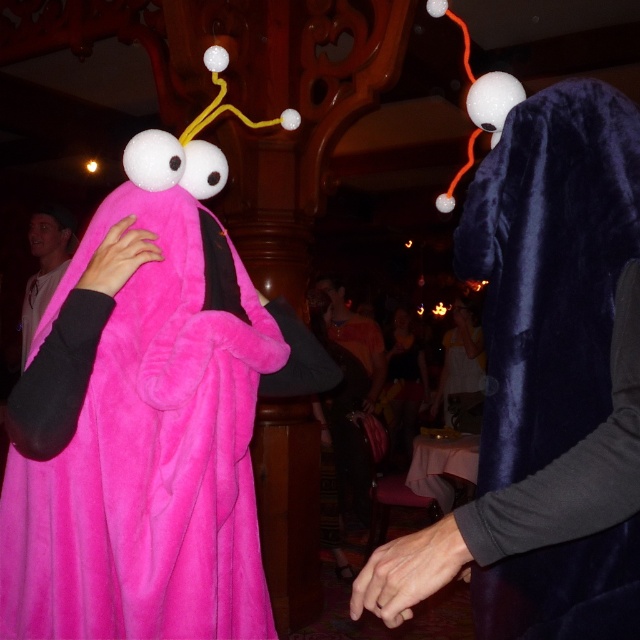
You are standing at the entrance of the event venue and want to greet both the pink fuzzy costume at left and the velvet blue mask at center. Which one should you approach first to minimize the total distance walked?

You should approach the velvet blue mask at center first because it is closer to the entrance than the pink fuzzy costume at left, which is further away by 15.98 feet.

You are standing in the middle of the room and want to hand a gift to both the velvet dark blue robe at right and the matte white shirt at left. Which one should you approach first to ensure you can reach them without moving too far?

You should approach the velvet dark blue robe at right first because it is closer to you than the matte white shirt at left, so you can reach them without moving too far.

What is located at the coordinate point [548,269] in the image?

The velvet dark blue robe at right is located at point [548,269].